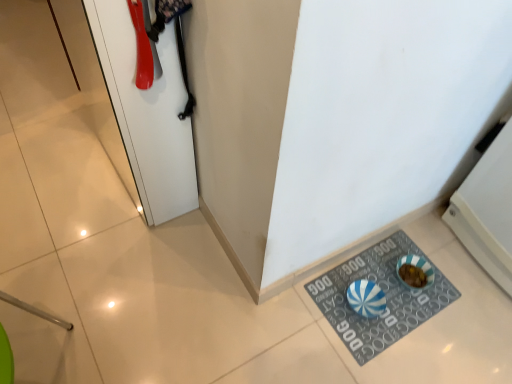
What are the coordinates of `free space to the right of blue and white striped rubber mat at lower right` in the screenshot? It's located at (466, 309).